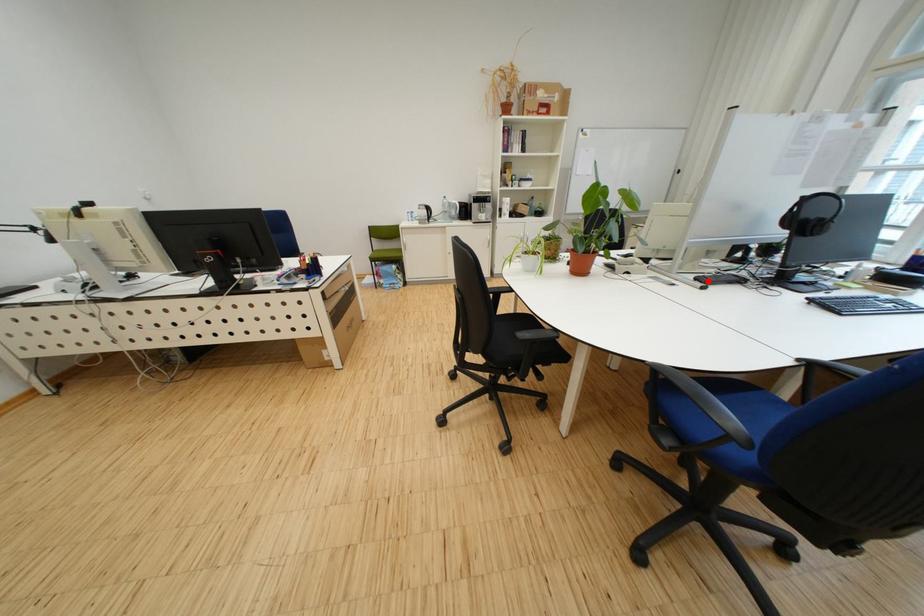
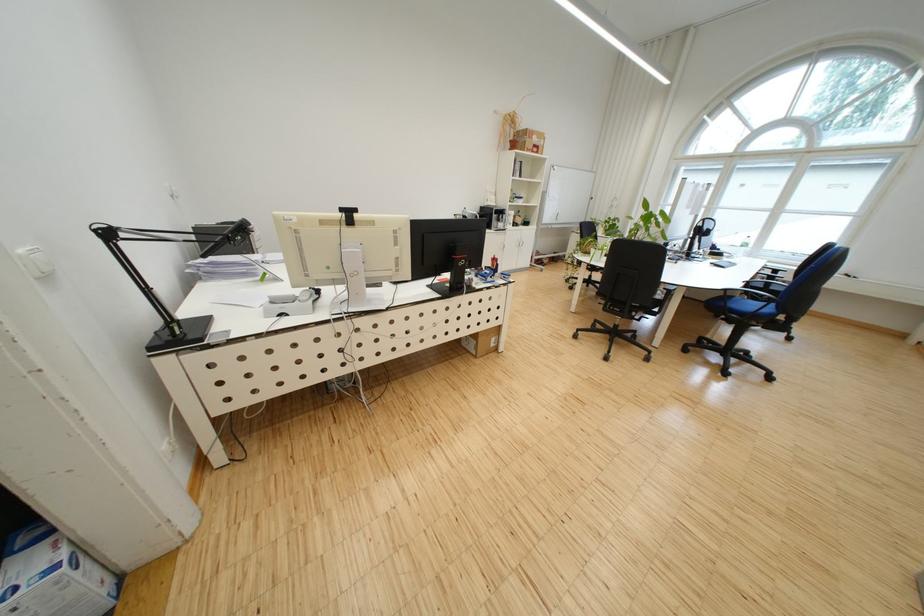
Question: I am providing you with two images of the same scene from different viewpoints. A red point is marked on the first image. At the location where the point appears in image 1, is it still visible in image 2?

Choices:
 (A) Yes
 (B) No

Answer: (B)